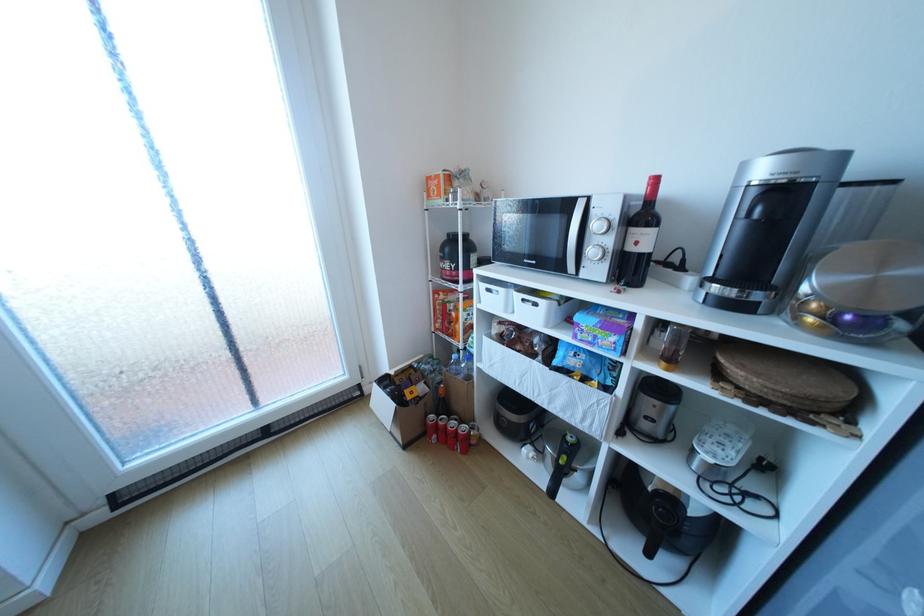
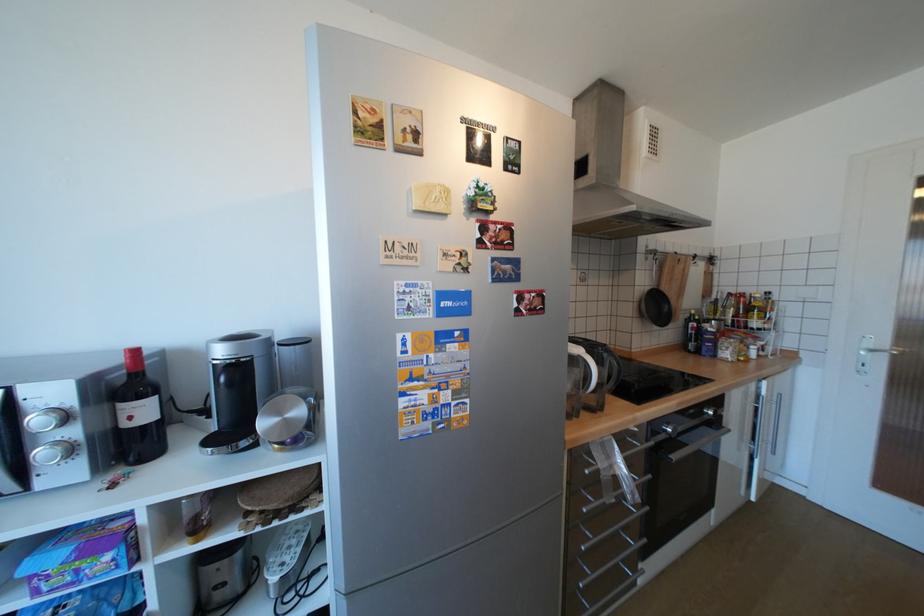
The point at (820, 320) is marked in the first image. Where is the corresponding point in the second image?

(286, 446)